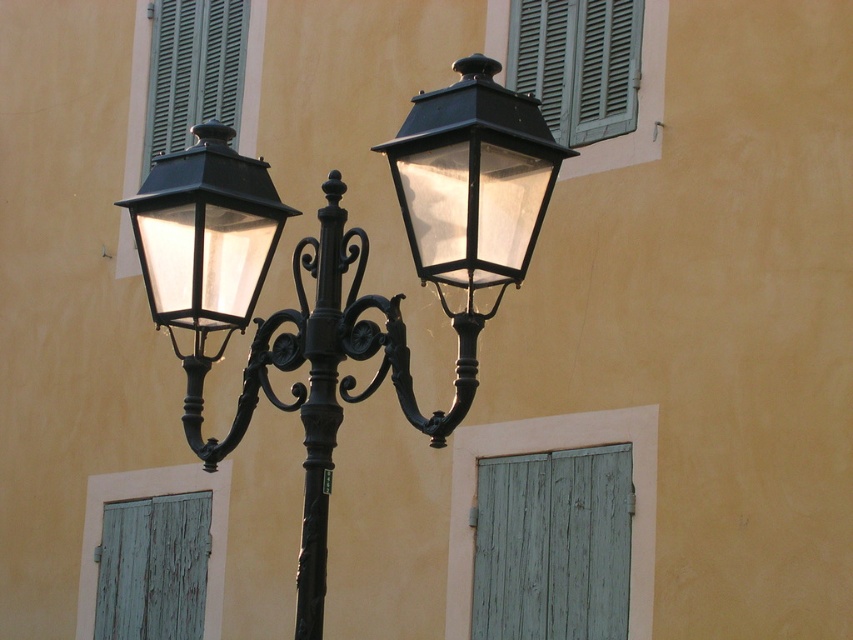
You are an interior designer assessing the building facade. You need to install a new decorative element between the green matte shutters at upper right and the peeling teal shutter at lower left. Which shutter should the new element be placed closer to if it needs to be near a larger shutter?

The new decorative element should be placed closer to the peeling teal shutter at lower left because it is larger than the green matte shutters at upper right.

You are standing in front of a vintage street lamp mounted on a beige wall. There is a point at coordinates point (x=590, y=115). Can you determine if this point is closer to you or farther away than the street lamp?

The point (x=590, y=115) is 122.13 feet from the viewer, so it is farther away than the street lamp which is mounted against the wall in front of you.